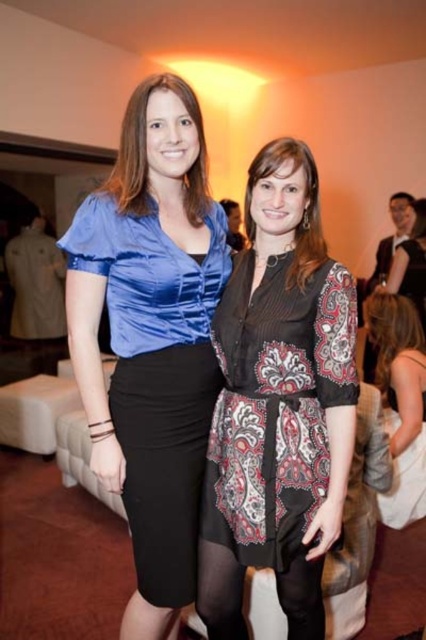
You are a photographer at a social event and want to ensure both the shiny blue blouse at left and the white satin dress at lower right are visible in your photo. Based on their positions, which clothing item is closer to the camera?

The shiny blue blouse at left is in front of the white satin dress at lower right, so it is closer to the camera.

You are at a social event and see two women standing close together. The first woman is wearing a blue satin blouse paired with a black pencil skirt, and the second woman is wearing a black outfit with a patterned, paisley design on the sleeves and waist. You notice a point at coordinates [150,337]. Which woman is this point located on?

The point at coordinates [150,337] is on the shiny blue blouse at left, so it belongs to the first woman wearing the blue satin blouse paired with a black pencil skirt.